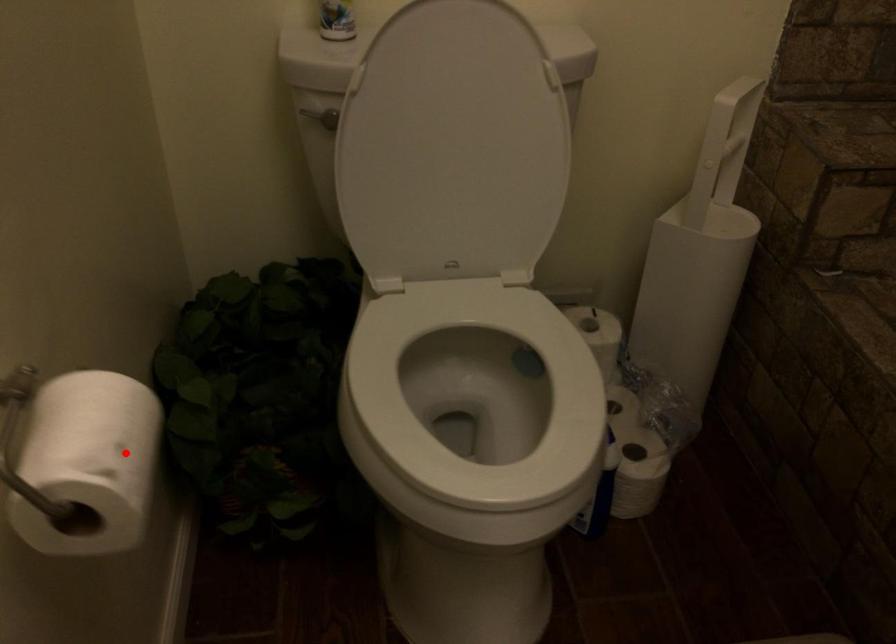
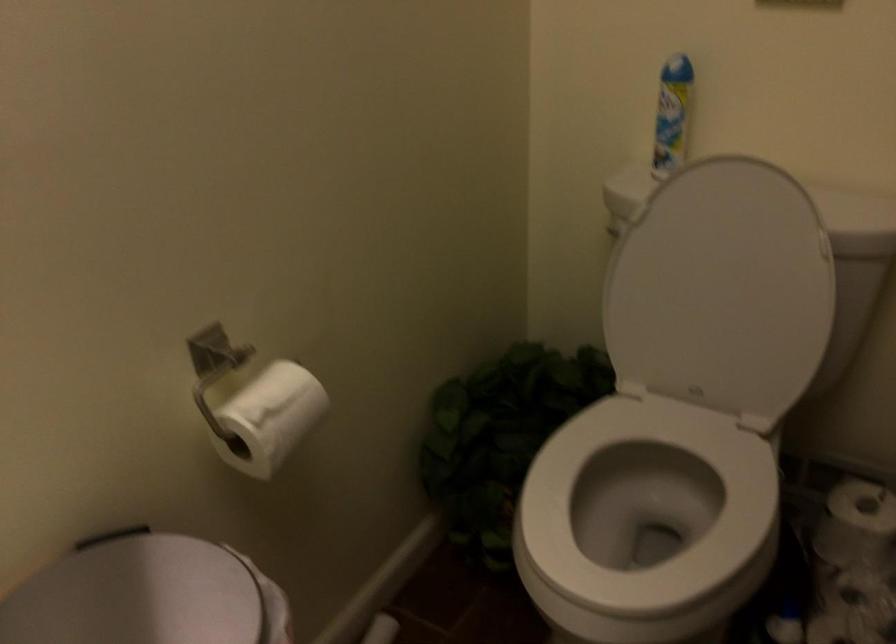
In the second image, find the point that corresponds to the highlighted location in the first image.

(271, 417)